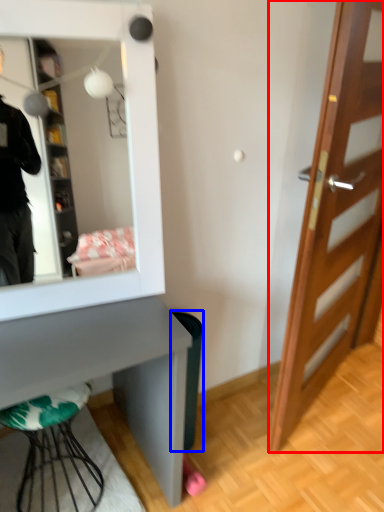
Question: Which of the following is the farthest to the observer, door (highlighted by a red box) or trash bin/can (highlighted by a blue box)?

Choices:
 (A) door
 (B) trash bin/can

Answer: (B)